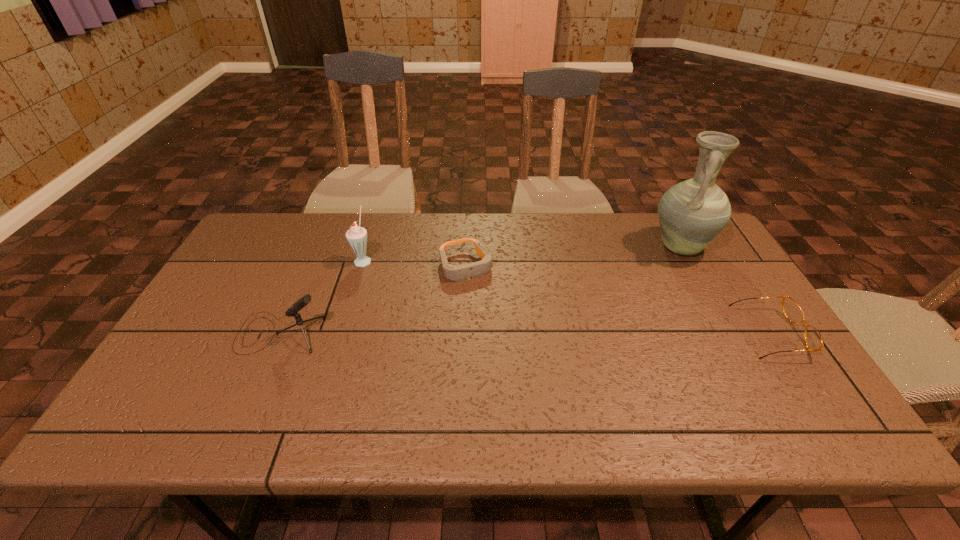
Locate an element on the screen. This screenshot has height=540, width=960. the third shortest object is located at coordinates (301, 303).

The image size is (960, 540). Identify the location of microphone. (301, 303).

Identify the location of spectacles. (792, 311).

You are a GUI agent. You are given a task and a screenshot of the screen. Output one action in this format:
    pyautogui.click(x=<x>, y=<y>)
    Task: Click on the tallest object
    
    Given the screenshot: What is the action you would take?
    pyautogui.click(x=691, y=213)

Identify the location of milkshake. Image resolution: width=960 pixels, height=540 pixels. (356, 236).

I want to click on the fourth object from right to left, so click(356, 236).

This screenshot has height=540, width=960. I want to click on goggles, so click(x=454, y=273).

Image resolution: width=960 pixels, height=540 pixels. Identify the location of vacant space located on the stand of the microphone. (196, 333).

This screenshot has width=960, height=540. I want to click on free spot located 0.100m on the stand of the microphone, so click(x=200, y=333).

Where is `vacant space located on the handle side of the pitcher`? vacant space located on the handle side of the pitcher is located at coordinates (637, 281).